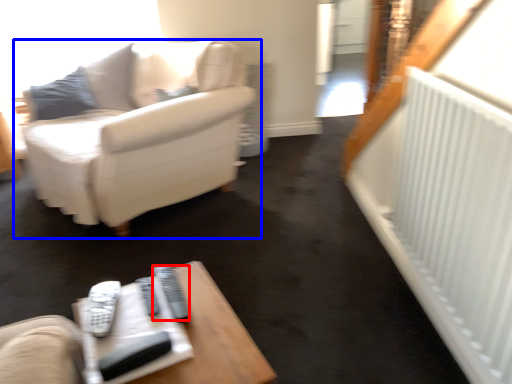
Question: Among these objects, which one is nearest to the camera, remote (highlighted by a red box) or studio couch (highlighted by a blue box)?

Choices:
 (A) remote
 (B) studio couch

Answer: (A)